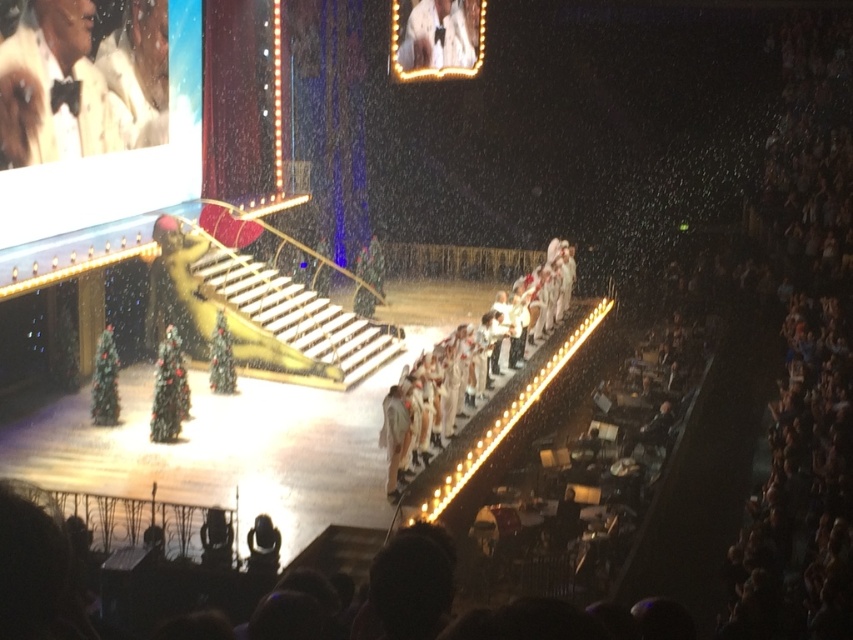
Question: Does white fabric dress at center appear under white satin dress at upper center?

Choices:
 (A) no
 (B) yes

Answer: (B)

Question: Which point is closer to the camera taking this photo?

Choices:
 (A) (496, 355)
 (B) (468, 6)

Answer: (A)

Question: Considering the relative positions of white fabric dress at center and white satin dress at upper center in the image provided, where is white fabric dress at center located with respect to white satin dress at upper center?

Choices:
 (A) right
 (B) left

Answer: (A)

Question: Which object appears closest to the camera in this image?

Choices:
 (A) white fabric dress at center
 (B) white satin dress at upper center

Answer: (A)

Question: Which object appears farthest from the camera in this image?

Choices:
 (A) white fabric dress at center
 (B) white satin dress at upper center

Answer: (B)

Question: Can you confirm if white fabric dress at center is positioned above white satin dress at upper center?

Choices:
 (A) yes
 (B) no

Answer: (B)